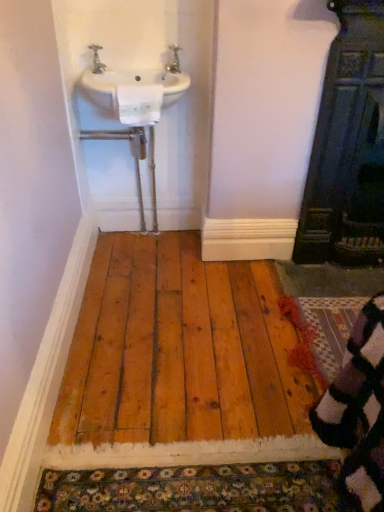
In order to face multicolored knitted rug at lower right, should I rotate leftwards or rightwards?

To face it directly, rotate right by 20.291 degrees.

What do you see at coordinates (179, 349) in the screenshot? I see `natural wood floor at center` at bounding box center [179, 349].

Where is `dark wood door at right`? This screenshot has width=384, height=512. dark wood door at right is located at coordinates (348, 146).

Is multicolored knitted rug at lower right smaller than dark wood door at right?

Correct, multicolored knitted rug at lower right occupies less space than dark wood door at right.

Considering the sizes of objects multicolored knitted rug at lower right and dark wood door at right in the image provided, who is thinner, multicolored knitted rug at lower right or dark wood door at right?

Thinner between the two is dark wood door at right.

Is multicolored knitted rug at lower right placed right next to dark wood door at right?

No, multicolored knitted rug at lower right is not in contact with dark wood door at right.

Which object is further away from the camera taking this photo, multicolored knitted rug at lower right or dark wood door at right?

Positioned behind is multicolored knitted rug at lower right.

From a real-world perspective, is multicolored knitted rug at lower right under white ceramic sink at upper left?

Yes.

Is multicolored knitted rug at lower right placed right next to white ceramic sink at upper left?

No, multicolored knitted rug at lower right is not touching white ceramic sink at upper left.

From the image's perspective, is multicolored knitted rug at lower right positioned above or below white ceramic sink at upper left?

From the image's perspective, multicolored knitted rug at lower right appears below white ceramic sink at upper left.

Based on the photo, relative to white ceramic sink at upper left, is multicolored knitted rug at lower right in front or behind?

multicolored knitted rug at lower right is in front of white ceramic sink at upper left.

From a real-world perspective, between natural wood floor at center and silver metallic tap at upper center, the first tap in the right-to-left sequence, who is vertically higher?

silver metallic tap at upper center, the first tap in the right-to-left sequence, is physically above.

From the picture: Considering the relative sizes of natural wood floor at center and silver metallic tap at upper center, which is counted as the second tap, starting from the left, in the image provided, is natural wood floor at center smaller than silver metallic tap at upper center, which is counted as the second tap, starting from the left,?

Incorrect, natural wood floor at center is not smaller in size than silver metallic tap at upper center, which is counted as the second tap, starting from the left.

From the picture: From the image's perspective, is natural wood floor at center on silver metallic tap at upper center, the first tap in the right-to-left sequence?

No, from the image's perspective, natural wood floor at center is not above silver metallic tap at upper center, the first tap in the right-to-left sequence.

Is natural wood floor at center aimed at silver metallic tap at upper center, the first tap in the right-to-left sequence?

No.

From a real-world perspective, who is located higher, multicolored knitted rug at lower right or metallic silver faucet at upper left, the first tap when ordered from left to right?

metallic silver faucet at upper left, the first tap when ordered from left to right, from a real-world perspective.

Can you confirm if multicolored knitted rug at lower right is positioned to the left of metallic silver faucet at upper left, the first tap when ordered from left to right?

In fact, multicolored knitted rug at lower right is to the right of metallic silver faucet at upper left, the first tap when ordered from left to right.

Is multicolored knitted rug at lower right taller than metallic silver faucet at upper left, the first tap when ordered from left to right?

In fact, multicolored knitted rug at lower right may be shorter than metallic silver faucet at upper left, the first tap when ordered from left to right.

How far apart are multicolored knitted rug at lower right and metallic silver faucet at upper left, the first tap when ordered from left to right?

A distance of 4.73 feet exists between multicolored knitted rug at lower right and metallic silver faucet at upper left, the first tap when ordered from left to right.

How many degrees apart are the facing directions of metallic silver faucet at upper left, the first tap when ordered from left to right, and natural wood floor at center?

There is a 179-degree angle between the facing directions of metallic silver faucet at upper left, the first tap when ordered from left to right, and natural wood floor at center.

You are a GUI agent. You are given a task and a screenshot of the screen. Output one action in this format:
    pyautogui.click(x=<x>, y=<y>)
    Task: Click on the hardwood that is under the metallic silver faucet at upper left, acting as the second tap starting from the right (from a real-world perspective)
    This screenshot has width=384, height=512.
    Given the screenshot: What is the action you would take?
    pyautogui.click(x=179, y=349)

From the image's perspective, is metallic silver faucet at upper left, acting as the second tap starting from the right, located above or below natural wood floor at center?

From the image's perspective, metallic silver faucet at upper left, acting as the second tap starting from the right, appears above natural wood floor at center.

Which is correct: metallic silver faucet at upper left, acting as the second tap starting from the right, is inside natural wood floor at center, or outside of it?

metallic silver faucet at upper left, acting as the second tap starting from the right, lies outside natural wood floor at center.

Between metallic silver faucet at upper left, the first tap when ordered from left to right, and multicolored knitted rug at lower right, which one appears on the left side from the viewer's perspective?

metallic silver faucet at upper left, the first tap when ordered from left to right.

Where is `doormat directly beneath the metallic silver faucet at upper left, the first tap when ordered from left to right (from a real-world perspective)`? The width and height of the screenshot is (384, 512). doormat directly beneath the metallic silver faucet at upper left, the first tap when ordered from left to right (from a real-world perspective) is located at coordinates (329, 327).

Is metallic silver faucet at upper left, the first tap when ordered from left to right, in contact with multicolored knitted rug at lower right?

metallic silver faucet at upper left, the first tap when ordered from left to right, is not next to multicolored knitted rug at lower right, and they're not touching.

From the image's perspective, does metallic silver faucet at upper left, the first tap when ordered from left to right, appear lower than multicolored knitted rug at lower right?

No, from the image's perspective, metallic silver faucet at upper left, the first tap when ordered from left to right, is not below multicolored knitted rug at lower right.

Which is less distant, (178, 71) or (99, 65)?

Point (178, 71) is farther from the camera than point (99, 65).

In the image, is silver metallic tap at upper center, the first tap in the right-to-left sequence, on the left side or the right side of metallic silver faucet at upper left, the first tap when ordered from left to right?

In the image, silver metallic tap at upper center, the first tap in the right-to-left sequence, appears on the right side of metallic silver faucet at upper left, the first tap when ordered from left to right.

Could you tell me if silver metallic tap at upper center, the first tap in the right-to-left sequence, is facing metallic silver faucet at upper left, acting as the second tap starting from the right?

No, silver metallic tap at upper center, the first tap in the right-to-left sequence, is not facing towards metallic silver faucet at upper left, acting as the second tap starting from the right.

Is the surface of silver metallic tap at upper center, the first tap in the right-to-left sequence, in direct contact with metallic silver faucet at upper left, acting as the second tap starting from the right?

silver metallic tap at upper center, the first tap in the right-to-left sequence, is not next to metallic silver faucet at upper left, acting as the second tap starting from the right, and they're not touching.

This screenshot has width=384, height=512. Identify the location of doormat below the dark wood door at right (from the image's perspective). (329, 327).

The width and height of the screenshot is (384, 512). Identify the location of sink above the multicolored knitted rug at lower right (from the image's perspective). (134, 89).

Considering their positions, is silver metallic tap at upper center, which is counted as the second tap, starting from the left, positioned closer to dark wood door at right than metallic silver faucet at upper left, acting as the second tap starting from the right?

silver metallic tap at upper center, which is counted as the second tap, starting from the left, lies closer to dark wood door at right than the other object.

Based on their spatial positions, is white ceramic sink at upper left or natural wood floor at center closer to metallic silver faucet at upper left, acting as the second tap starting from the right?

white ceramic sink at upper left.

From the image, which object appears to be nearer to metallic silver faucet at upper left, acting as the second tap starting from the right, dark wood door at right or natural wood floor at center?

Based on the image, dark wood door at right appears to be nearer to metallic silver faucet at upper left, acting as the second tap starting from the right.

Which object lies nearer to the anchor point metallic silver faucet at upper left, acting as the second tap starting from the right, natural wood floor at center or dark wood door at right?

dark wood door at right lies closer to metallic silver faucet at upper left, acting as the second tap starting from the right, than the other object.

Looking at the image, which one is located further to white ceramic sink at upper left, natural wood floor at center or dark wood door at right?

The object further to white ceramic sink at upper left is natural wood floor at center.

Estimate the real-world distances between objects in this image. Which object is further from multicolored knitted rug at lower right, white ceramic sink at upper left or dark wood door at right?

Based on the image, white ceramic sink at upper left appears to be further to multicolored knitted rug at lower right.

From the image, which object appears to be nearer to silver metallic tap at upper center, the first tap in the right-to-left sequence, white ceramic sink at upper left or natural wood floor at center?

Among the two, white ceramic sink at upper left is located nearer to silver metallic tap at upper center, the first tap in the right-to-left sequence.

When comparing their distances from dark wood door at right, does natural wood floor at center or silver metallic tap at upper center, which is counted as the second tap, starting from the left, seem further?

Based on the image, silver metallic tap at upper center, which is counted as the second tap, starting from the left, appears to be further to dark wood door at right.

Identify the location of door between silver metallic tap at upper center, the first tap in the right-to-left sequence, and natural wood floor at center from top to bottom. (348, 146).

The height and width of the screenshot is (512, 384). I want to click on hardwood located between metallic silver faucet at upper left, the first tap when ordered from left to right, and dark wood door at right in the left-right direction, so click(x=179, y=349).

Identify the location of door between silver metallic tap at upper center, which is counted as the second tap, starting from the left, and multicolored knitted rug at lower right in the up-down direction. Image resolution: width=384 pixels, height=512 pixels. (348, 146).

Identify the location of sink between metallic silver faucet at upper left, acting as the second tap starting from the right, and dark wood door at right, in the horizontal direction. (134, 89).